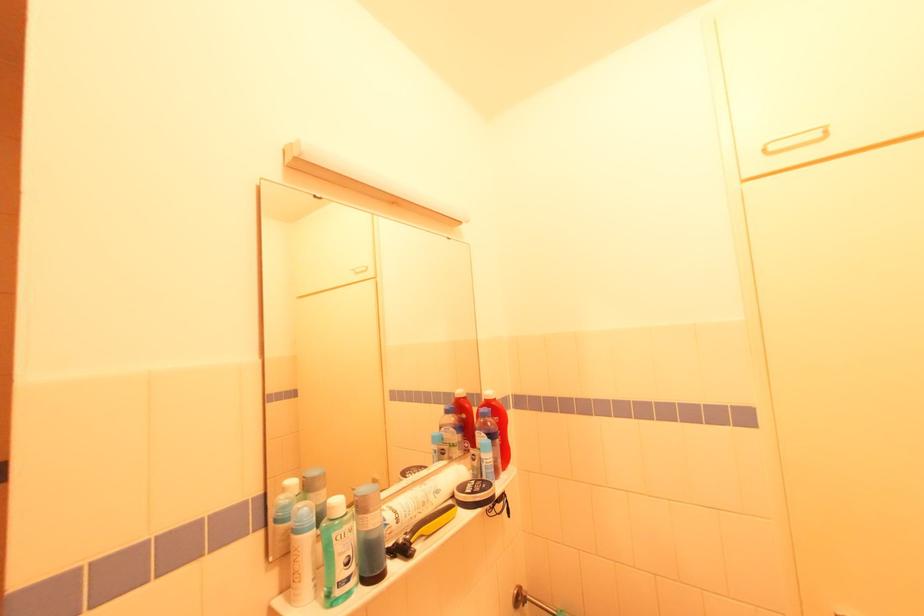
What do you see at coordinates (796, 140) in the screenshot?
I see `the white cabinet handle` at bounding box center [796, 140].